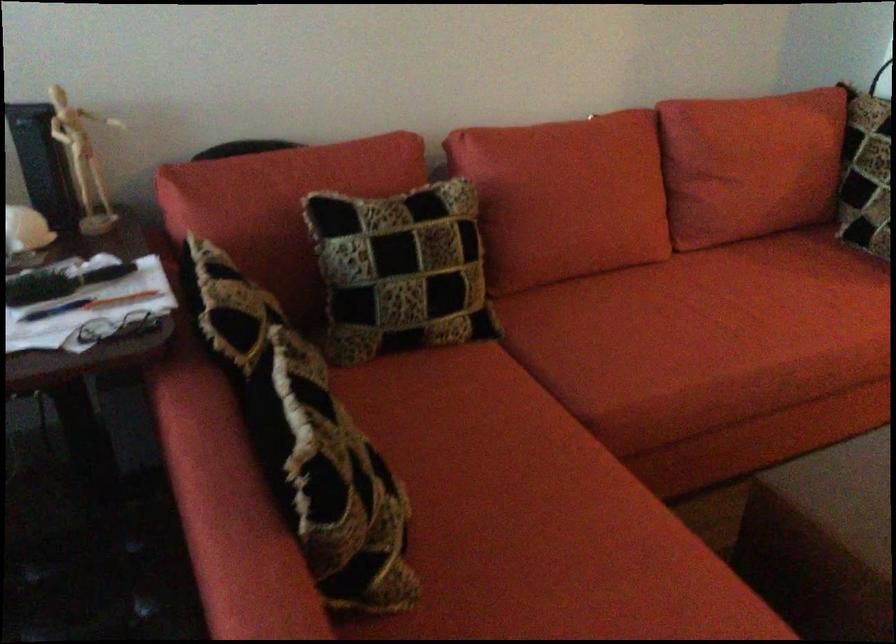
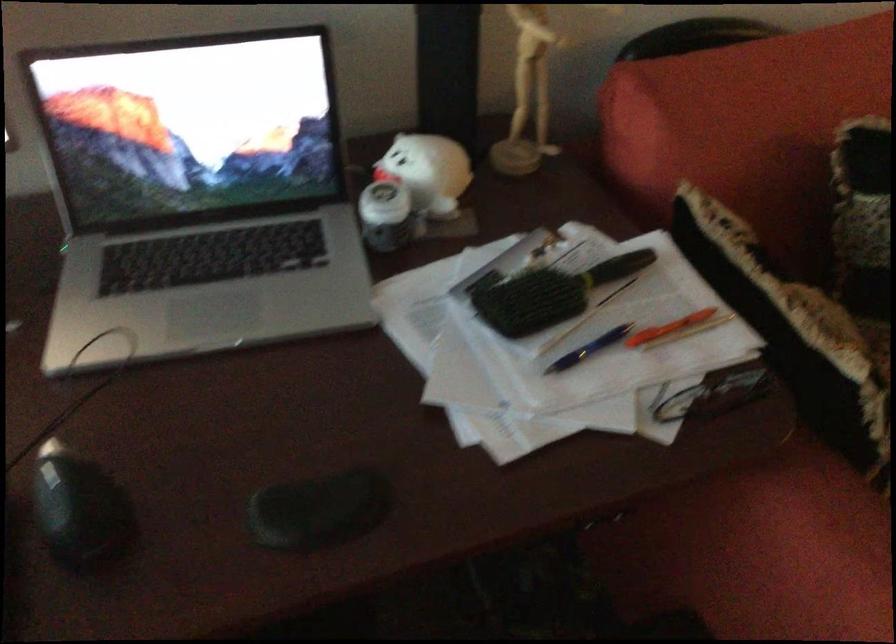
Where in the second image is the point corresponding to [100,277] from the first image?

(616, 267)